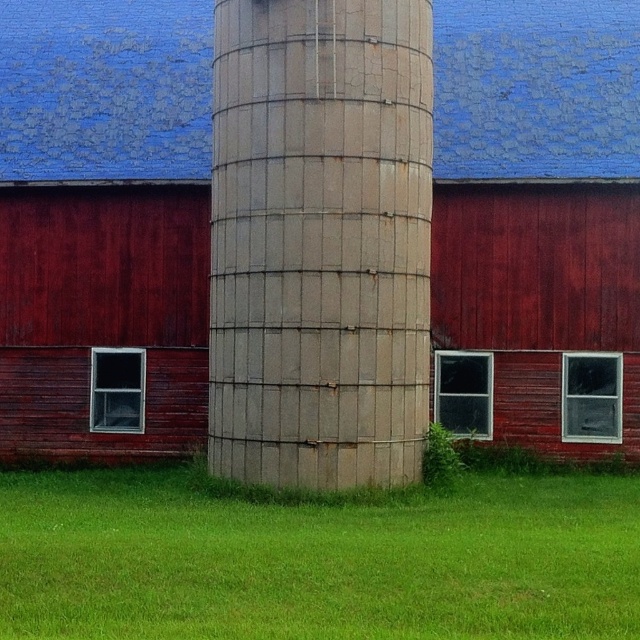
Question: Which object is closer to the camera taking this photo?

Choices:
 (A) green grass at lower center
 (B) rusty metal water tower at center

Answer: (A)

Question: Is rusty metal water tower at center positioned behind green grass at lower center?

Choices:
 (A) no
 (B) yes

Answer: (B)

Question: Which object is closer to the camera taking this photo?

Choices:
 (A) green grass at lower center
 (B) rusty metal water tower at center

Answer: (A)

Question: Is rusty metal water tower at center closer to camera compared to green grass at lower center?

Choices:
 (A) yes
 (B) no

Answer: (B)

Question: Does rusty metal water tower at center have a greater width compared to green grass at lower center?

Choices:
 (A) yes
 (B) no

Answer: (B)